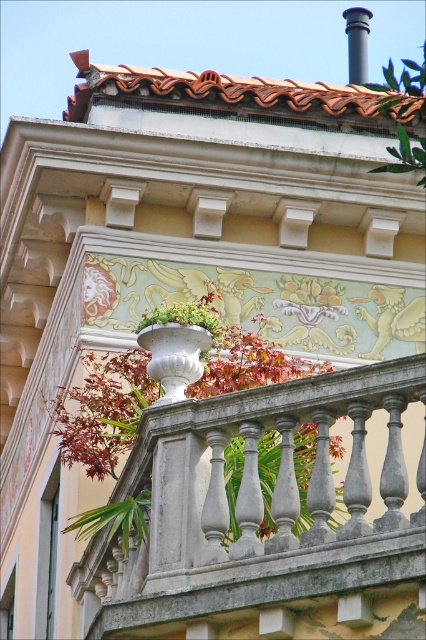
Does green leafy plant at upper right have a lesser height compared to white glossy planter at center?

No.

Can you confirm if green leafy plant at upper right is smaller than white glossy planter at center?

No.

Who is more forward, (368, 84) or (161, 308)?

Point (161, 308)

Identify the location of green leafy plant at upper right. (403, 113).

Is white stone planter at upper center wider than green leafy plant at upper right?

Correct, the width of white stone planter at upper center exceeds that of green leafy plant at upper right.

Can you confirm if white stone planter at upper center is bigger than green leafy plant at upper right?

Actually, white stone planter at upper center might be smaller than green leafy plant at upper right.

Measure the distance between point (83,384) and camera.

The distance of point (83,384) from camera is 68.18 meters.

I want to click on white stone planter at upper center, so click(x=103, y=410).

Based on the photo, is white stone planter at upper center wider than white glossy planter at center?

Indeed, white stone planter at upper center has a greater width compared to white glossy planter at center.

Is white stone planter at upper center to the right of white glossy planter at center from the viewer's perspective?

Yes, white stone planter at upper center is to the right of white glossy planter at center.

I want to click on white stone planter at upper center, so (x=103, y=410).